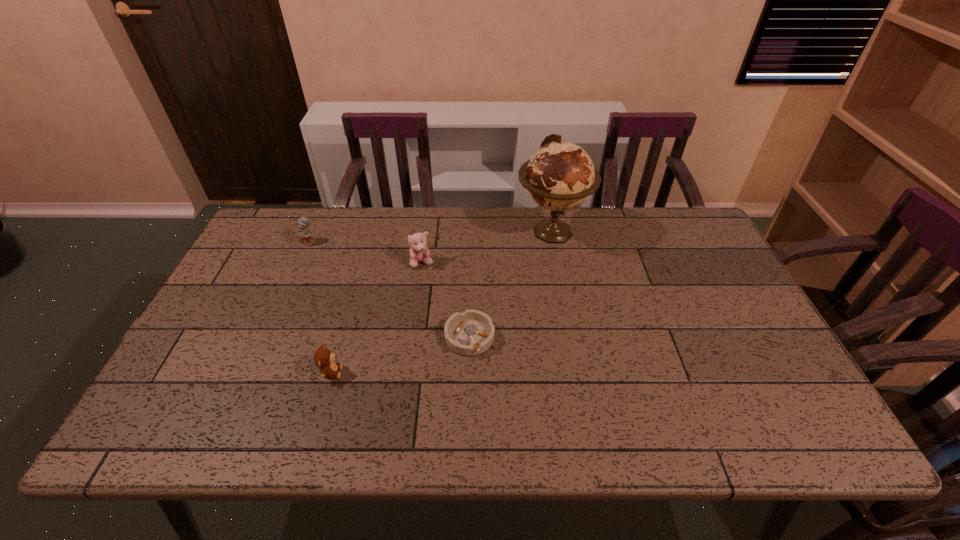
Locate an element on the screen. The width and height of the screenshot is (960, 540). vacant space located on the front of the rightmost object showing Asia is located at coordinates (569, 329).

Identify the location of vacant area situated at the face of the tallest teddy bear. The width and height of the screenshot is (960, 540). (406, 379).

Locate an element on the screen. vacant space located on the front-facing side of the leftmost teddy bear is located at coordinates (298, 268).

The height and width of the screenshot is (540, 960). In order to click on free spot located on the face of the nearest object in this screenshot , I will do `click(479, 372)`.

The image size is (960, 540). What are the coordinates of `free point located 0.270m on the right of the second nearest object` in the screenshot? It's located at (599, 338).

At what (x,y) coordinates should I click in order to perform the action: click on globe located in the far edge section of the desktop. Please return your answer as a coordinate pair (x, y). Image resolution: width=960 pixels, height=540 pixels. Looking at the image, I should click on (560, 175).

In order to click on teddy bear located in the far edge section of the desktop in this screenshot , I will do `click(305, 235)`.

At what (x,y) coordinates should I click in order to perform the action: click on object present at the left edge. Please return your answer as a coordinate pair (x, y). This screenshot has width=960, height=540. Looking at the image, I should click on (305, 235).

Image resolution: width=960 pixels, height=540 pixels. I want to click on object that is at the far left corner, so click(305, 235).

Locate an element on the screen. The width and height of the screenshot is (960, 540). vacant area at the far edge is located at coordinates (433, 224).